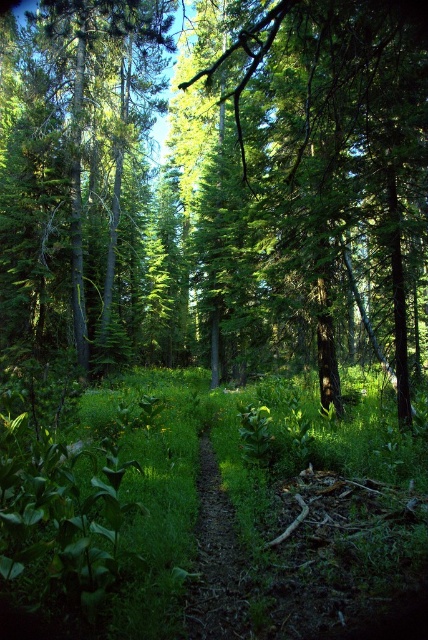
The width and height of the screenshot is (428, 640). Identify the location of green leafy grass at center. (237, 531).

Describe the element at coordinates (237, 531) in the screenshot. I see `green leafy grass at center` at that location.

Identify the location of green leafy grass at center. (237, 531).

Does dirt path at center have a smaller size compared to green leafy tree at center?

Yes.

Who is more distant from viewer, (228, 627) or (237, 134)?

Point (237, 134)

This screenshot has height=640, width=428. Describe the element at coordinates (216, 561) in the screenshot. I see `dirt path at center` at that location.

Find the location of a particular element. This screenshot has height=640, width=428. dirt path at center is located at coordinates (216, 561).

Who is shorter, green matte tree at left or green leafy tree at center?

With less height is green leafy tree at center.

Describe the element at coordinates (77, 157) in the screenshot. I see `green matte tree at left` at that location.

Which is in front, point (74, 134) or point (264, 49)?

Point (264, 49) is in front.

Locate an element on the screen. The width and height of the screenshot is (428, 640). green matte tree at left is located at coordinates (77, 157).